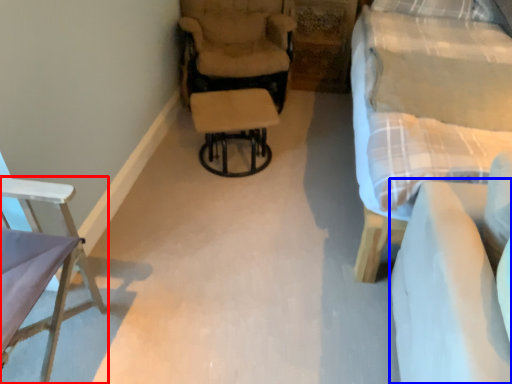
Question: Which object is closer to the camera taking this photo, chair (highlighted by a red box) or couch (highlighted by a blue box)?

Choices:
 (A) chair
 (B) couch

Answer: (B)